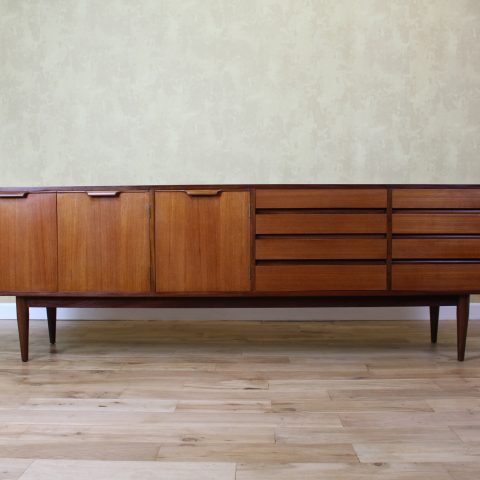
Find the location of a particular element. unique wooden table with drawers and cabinet doors is located at coordinates (1, 187).